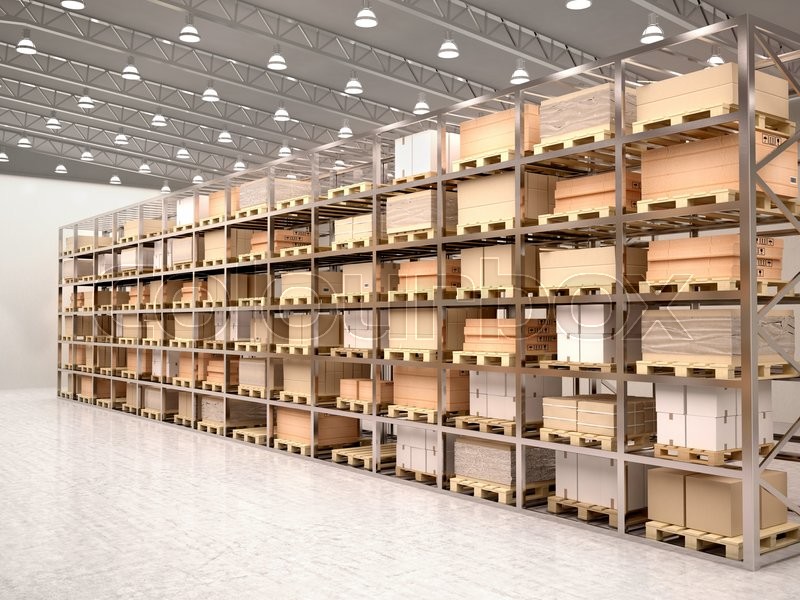
I want to click on rails across the ceiling, so click(x=669, y=14), click(x=522, y=52), click(x=406, y=78), click(x=354, y=116), click(x=308, y=136), click(x=244, y=145), click(x=222, y=164), click(x=182, y=176).